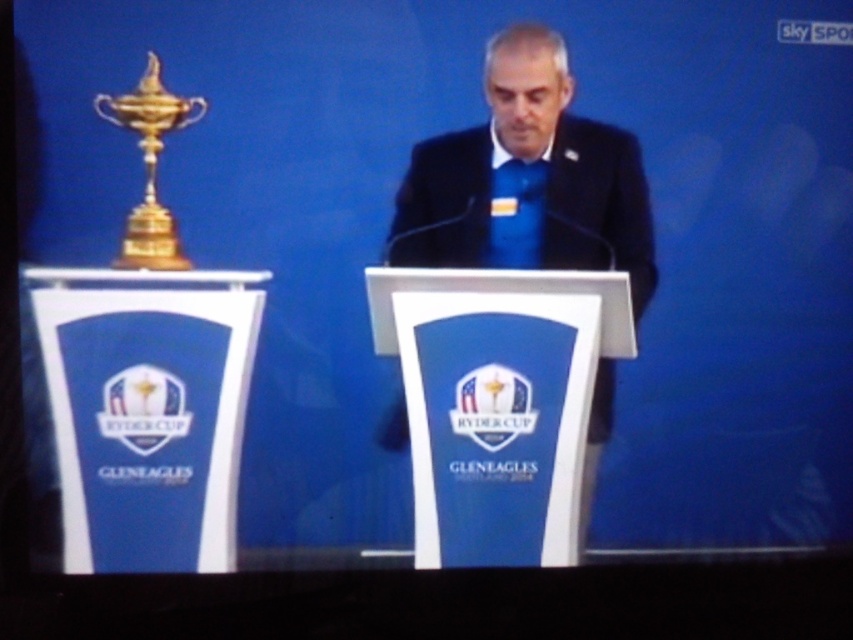
You are a photographer at the event and need to capture a closeup shot of both the blue satin suit at center and the gold polished metal trophy at left. The camera you are using has a maximum focus range of 12 inches. Will you be able to photograph both subjects clearly in the same frame?

The blue satin suit at center and gold polished metal trophy at left are 12.30 inches apart. Since the distance between them exceeds the camera maximum focus range of 12 inches, you will not be able to capture both subjects clearly in the same frame.

You are a photographer at the Ryder Cup event and need to position your camera to capture the blue satin suit at center. According to the coordinates provided, where should you aim your camera?

The blue satin suit at center is located at coordinates point (527,179), so you should aim your camera at that point to capture it.